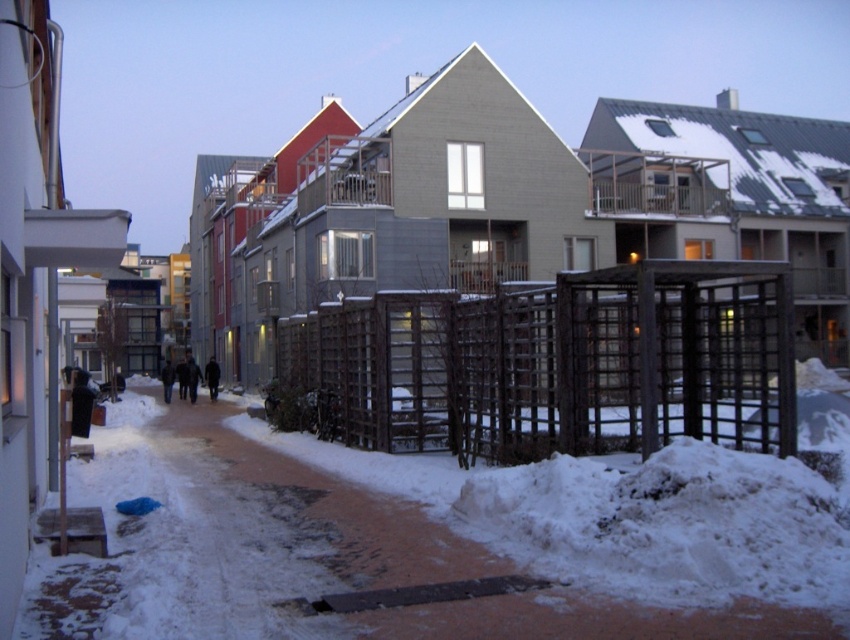
Question: Can you confirm if brown concrete pavement at center is positioned to the left of brown wooden fence at center?

Choices:
 (A) yes
 (B) no

Answer: (A)

Question: Which point appears closest to the camera in this image?

Choices:
 (A) (707, 406)
 (B) (491, 580)

Answer: (B)

Question: Can you confirm if brown concrete pavement at center is thinner than brown wooden fence at center?

Choices:
 (A) no
 (B) yes

Answer: (A)

Question: Does brown concrete pavement at center appear under brown wooden fence at center?

Choices:
 (A) yes
 (B) no

Answer: (A)

Question: Which point is closer to the camera taking this photo?

Choices:
 (A) (265, 612)
 (B) (505, 339)

Answer: (A)

Question: Which point is farther from the camera taking this photo?

Choices:
 (A) (748, 396)
 (B) (197, 532)

Answer: (A)